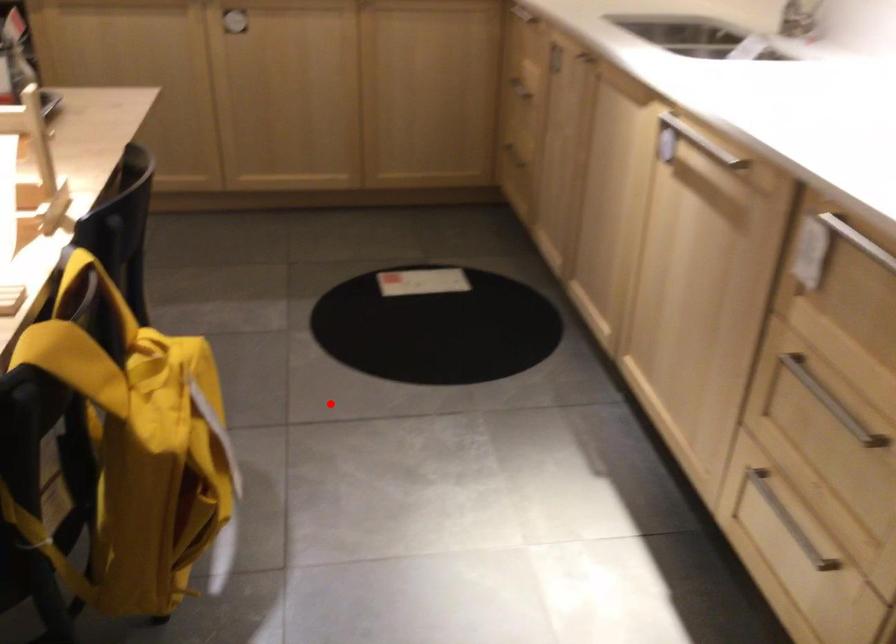
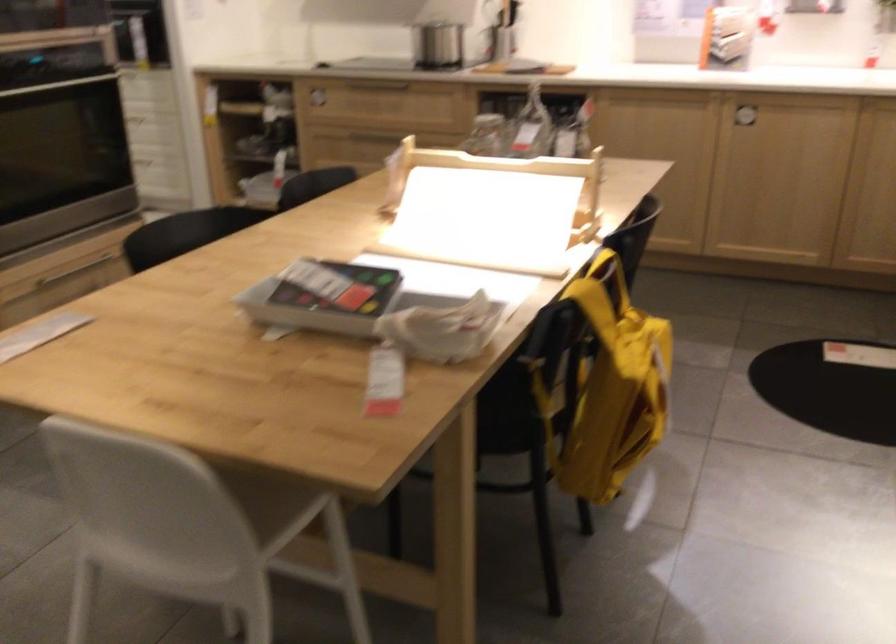
Question: I am providing you with two images of the same scene from different viewpoints. A red point is shown in image1. For the corresponding object point in image2, is it positioned nearer or farther from the camera?

Choices:
 (A) Nearer
 (B) Farther

Answer: (B)